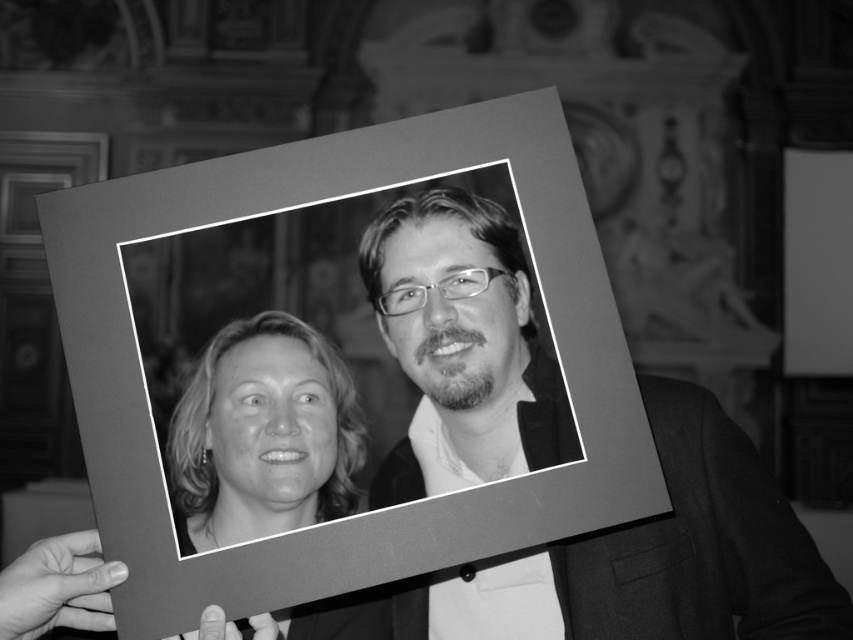
You are a photographer analyzing the image. You notice the matte gray picture frame at center and the smooth blonde hair at center. Which object is positioned closer to your viewpoint?

The matte gray picture frame at center is closer to the viewer than the smooth blonde hair at center.

You are a photographer adjusting lighting for a portrait. You notice the matte gray picture frame at center and the smooth blonde hair at center in your shot. Which object is closer to the camera based on their distance apart?

The matte gray picture frame at center and smooth blonde hair at center are 3.21 inches apart, so it is not possible to determine which is closer based solely on the distance between them.

You are standing in the scene and want to place a small decorative item exactly at the center of the matte gray picture frame at center. According to the coordinates provided, where should you place it?

The center of the matte gray picture frame at center is at coordinates point (375, 509), so you should place the item there.